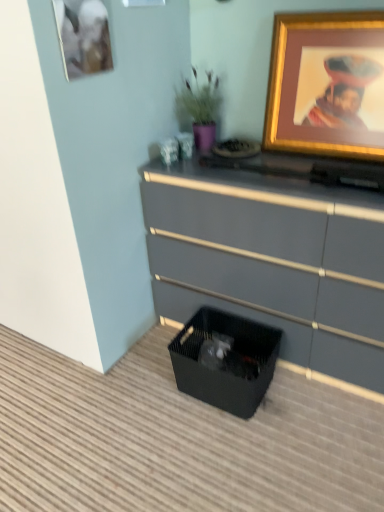
Find the location of `free space above matte gray dresser at center (from a real-world perspective)`. free space above matte gray dresser at center (from a real-world perspective) is located at coordinates (269, 160).